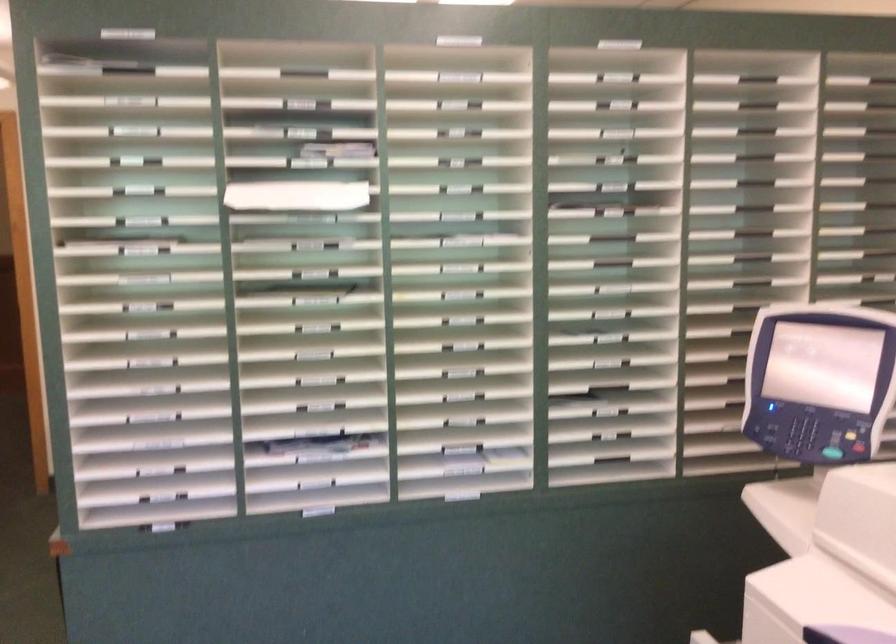
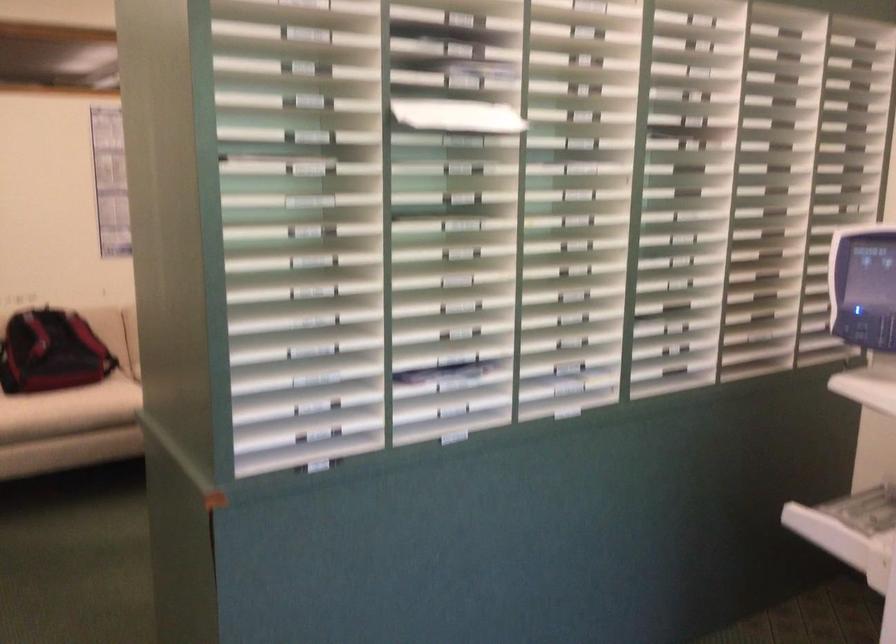
Question: Which direction would the cameraman need to move to produce the second image? Reply with the corresponding letter.

Choices:
 (A) Left
 (B) Right
 (C) Forward
 (D) Backward

Answer: (A)